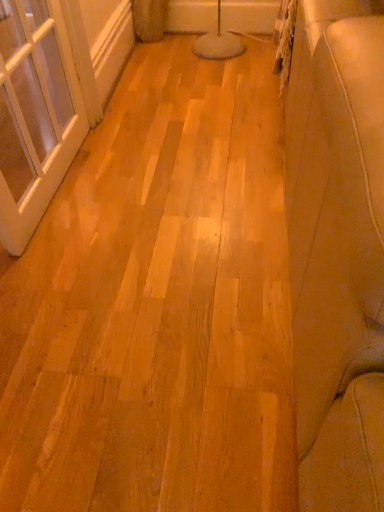
I want to click on leather couch at right, so click(x=337, y=253).

Describe the element at coordinates (337, 253) in the screenshot. The height and width of the screenshot is (512, 384). I see `leather couch at right` at that location.

Image resolution: width=384 pixels, height=512 pixels. Find the location of `leather couch at right`. leather couch at right is located at coordinates (337, 253).